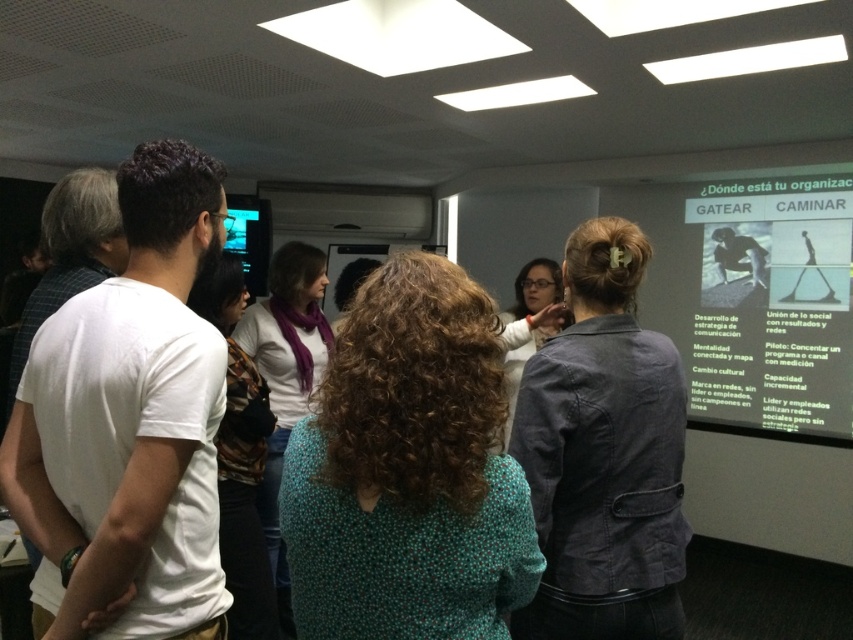
Does point (488, 317) come in front of point (82, 444)?

Yes.

Locate an element on the screen. This screenshot has width=853, height=640. green printed shirt at center is located at coordinates (408, 470).

At what (x,y) coordinates should I click in order to perform the action: click on green printed shirt at center. Please return your answer as a coordinate pair (x, y). This screenshot has height=640, width=853. Looking at the image, I should click on (408, 470).

Consider the image. Can you confirm if matte white shirt at center is positioned below matte black screen at upper left?

Yes, matte white shirt at center is below matte black screen at upper left.

Between matte white shirt at center and matte black screen at upper left, which one has less height?

matte white shirt at center

Between point (508, 337) and point (248, 209), which one is positioned in front?

Point (508, 337) is more forward.

Where is `matte white shirt at center`? matte white shirt at center is located at coordinates (529, 321).

Can you confirm if green printed shirt at center is positioned to the left of matte black screen at upper left?

In fact, green printed shirt at center is to the right of matte black screen at upper left.

Is green printed shirt at center further to the viewer compared to matte black screen at upper left?

No.

Locate an element on the screen. Image resolution: width=853 pixels, height=640 pixels. green printed shirt at center is located at coordinates (408, 470).